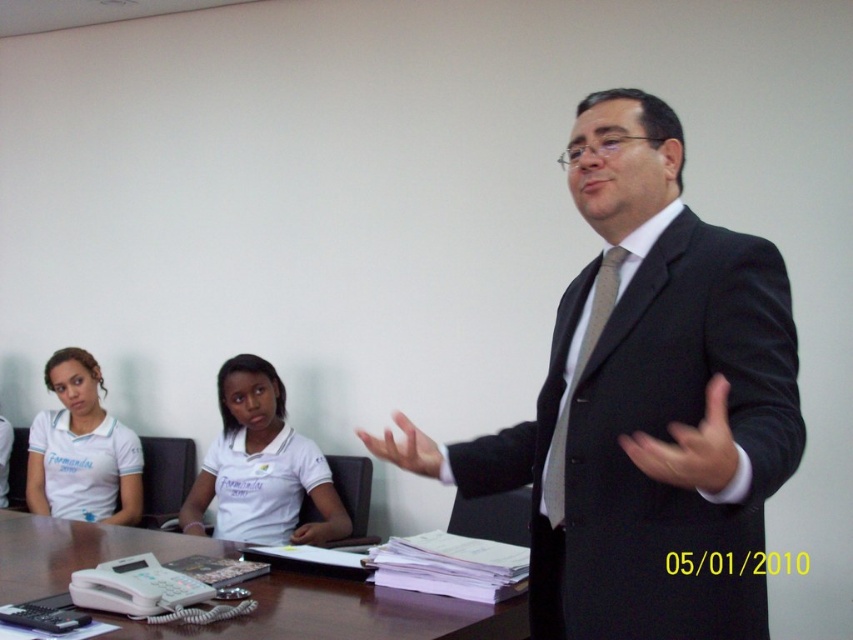
Question: Estimate the real-world distances between objects in this image. Which object is farther from the black suit at center?

Choices:
 (A) white fabric shirt at left
 (B) satin gray tie at center

Answer: (A)

Question: Is white cotton shirt at center smaller than white fabric shirt at left?

Choices:
 (A) no
 (B) yes

Answer: (A)

Question: Is white cotton shirt at center to the right of satin gray tie at center from the viewer's perspective?

Choices:
 (A) no
 (B) yes

Answer: (A)

Question: Among these points, which one is farthest from the camera?

Choices:
 (A) (195, 493)
 (B) (546, 472)
 (C) (73, 564)
 (D) (109, 509)

Answer: (D)

Question: Which object appears farthest from the camera in this image?

Choices:
 (A) brown wooden table at center
 (B) white cotton shirt at center
 (C) black suit at center

Answer: (B)

Question: Can you confirm if black suit at center is wider than white fabric shirt at left?

Choices:
 (A) no
 (B) yes

Answer: (B)